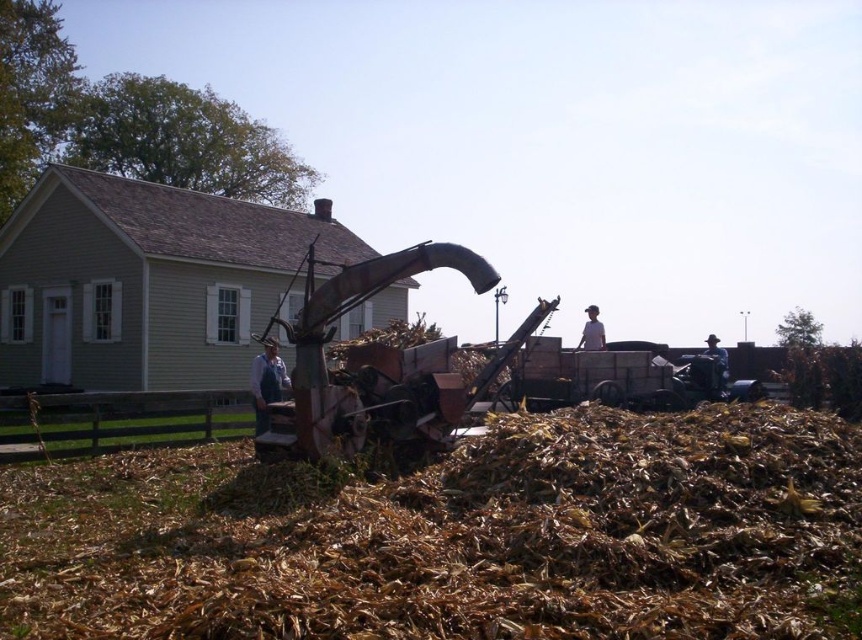
You are a farmer trying to decide which item to place in a narrow storage bin that can only accommodate items with a width of 20 cm or less. You have the denim overalls at center and the brown leather hat at right. Based on their sizes, which item is more likely to fit in the bin?

The denim overalls at center is thinner than the brown leather hat at right, so the denim overalls at center is more likely to fit in the narrow storage bin with a 20 cm width limit.

You are a farmer who needs to locate both the white cloth hat at upper right and the brown leather hat at right. According to the scene, which hat is positioned to the left of the other?

The white cloth hat at upper right is positioned on the left side of brown leather hat at right.

You are a farmer planning to place a new tool that is 1 meter wide between the denim overalls at center and the white cloth hat at upper right. Based on the scene, can the space between them accommodate the tool?

The denim overalls at center is narrower than the white cloth hat at upper right, but the exact width of the space between them isn